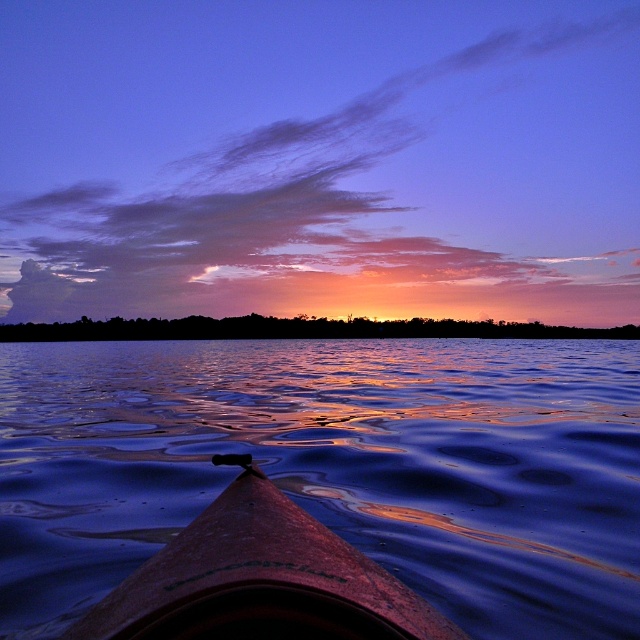
Question: Which is nearer to the glossy water at center?

Choices:
 (A) silhouetted trees at center
 (B) smooth brown canoe at center

Answer: (B)

Question: Is glossy water at center behind smooth brown canoe at center?

Choices:
 (A) no
 (B) yes

Answer: (B)

Question: Which point is closer to the camera taking this photo?

Choices:
 (A) click(x=10, y=323)
 (B) click(x=198, y=554)
 (C) click(x=509, y=513)

Answer: (B)

Question: Where is glossy water at center located in relation to silhouetted trees at center in the image?

Choices:
 (A) above
 (B) below

Answer: (B)

Question: Observing the image, what is the correct spatial positioning of glossy water at center in reference to smooth brown canoe at center?

Choices:
 (A) above
 (B) below

Answer: (B)

Question: Which point is closer to the camera?

Choices:
 (A) smooth brown canoe at center
 (B) glossy water at center

Answer: (A)